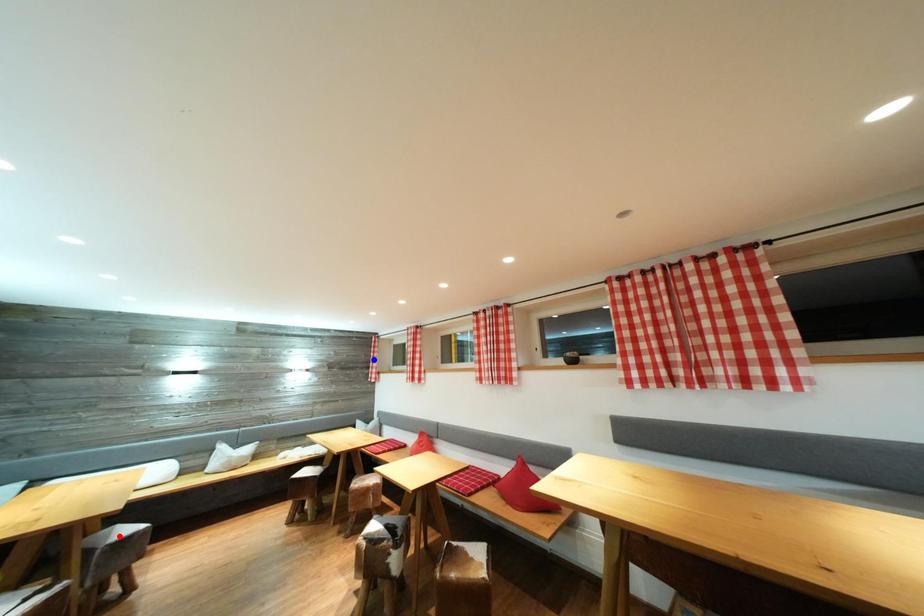
Question: Two points are marked on the image. Which point is closer to the camera?

Choices:
 (A) Blue point is closer.
 (B) Red point is closer.

Answer: (B)